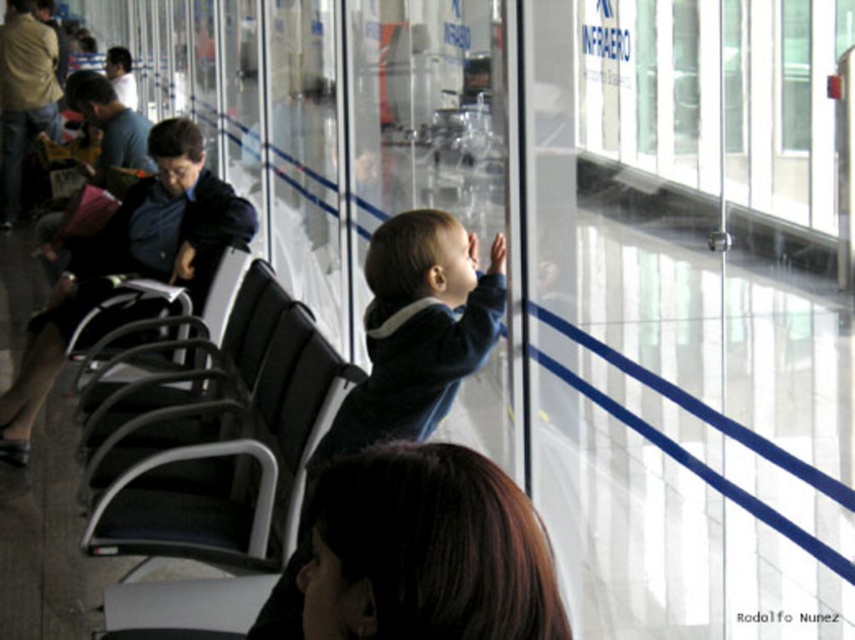
You are standing in the airport terminal and see two points marked on the glass partition where the child is leaning. The first point is at coordinates point(255, 384) and the second is at point(428, 412). Which point is closer to you?

Point(255, 384) is closer to you because it is further to the viewer than point(428, 412).

You are a passenger waiting at the airport. You see a black fabric chair at center and a dark blue sweater at center. Which object is closer to the left side of the scene?

The black fabric chair at center is closer to the left side of the scene because it is positioned to the left of the dark blue sweater at center.

You are a traveler who needs to sit down. You see a black fabric chair at center and a dark blue sweater at center. Which object is wider?

The black fabric chair at center is wider than the dark blue sweater at center.